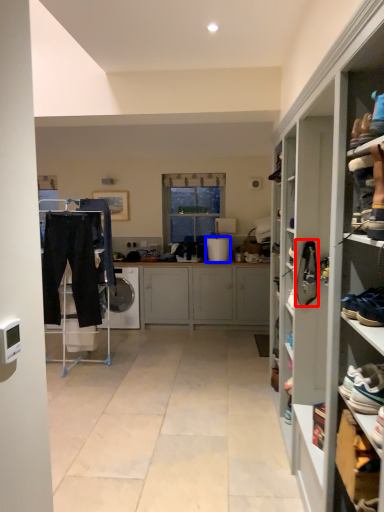
Question: Which point is further to the camera, shoe (highlighted by a red box) or appliance (highlighted by a blue box)?

Choices:
 (A) shoe
 (B) appliance

Answer: (B)